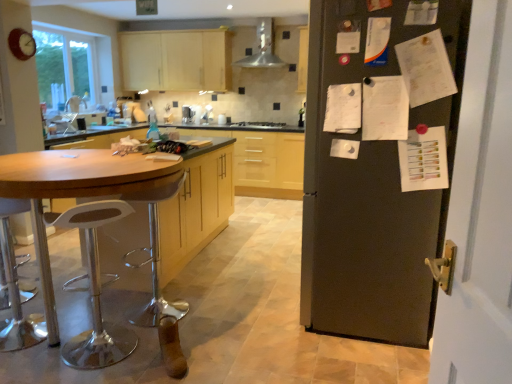
Locate an element on the screen. free spot to the left of metallic silver bar stool at left, placed as the 1th bar stool when sorted from back to front is located at coordinates (100, 312).